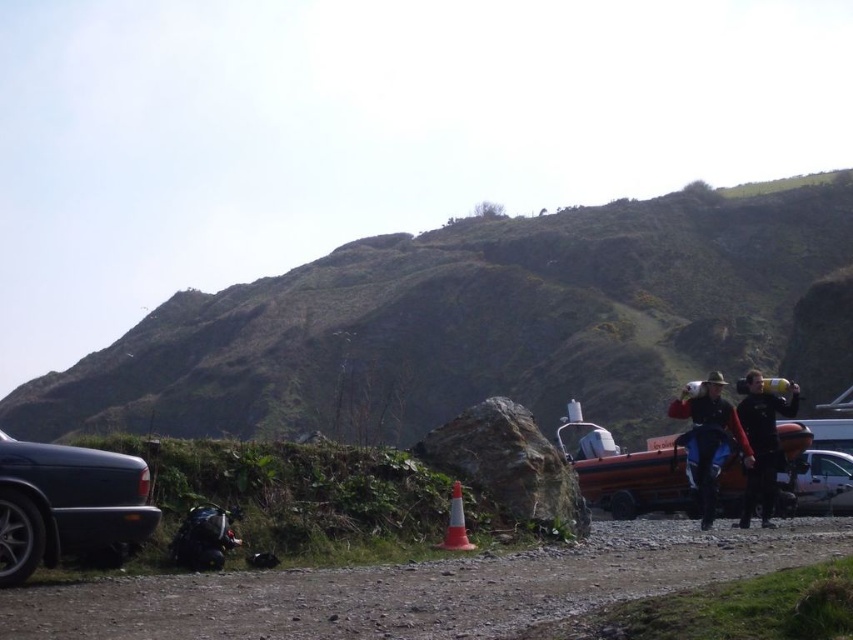
Question: Among these objects, which one is nearest to the camera?

Choices:
 (A) orange plastic cone at lower center
 (B) black rubber boots at right
 (C) reddish-orange fabric jacket at right

Answer: (A)

Question: From the image, what is the correct spatial relationship of green grassy hillside at upper center in relation to shiny metallic car at lower left?

Choices:
 (A) left
 (B) right

Answer: (A)

Question: Which point is farther from the camera taking this photo?

Choices:
 (A) (451, 486)
 (B) (260, 320)
 (C) (816, 493)

Answer: (B)

Question: Which point is closer to the camera taking this photo?

Choices:
 (A) (456, 532)
 (B) (10, 470)
 (C) (772, 429)

Answer: (B)

Question: Is shiny metallic car at lower left to the right of metallic silver car at lower right from the viewer's perspective?

Choices:
 (A) yes
 (B) no

Answer: (B)

Question: From the image, what is the correct spatial relationship of green grassy hillside at upper center in relation to shiny metallic car at lower left?

Choices:
 (A) left
 (B) right

Answer: (A)